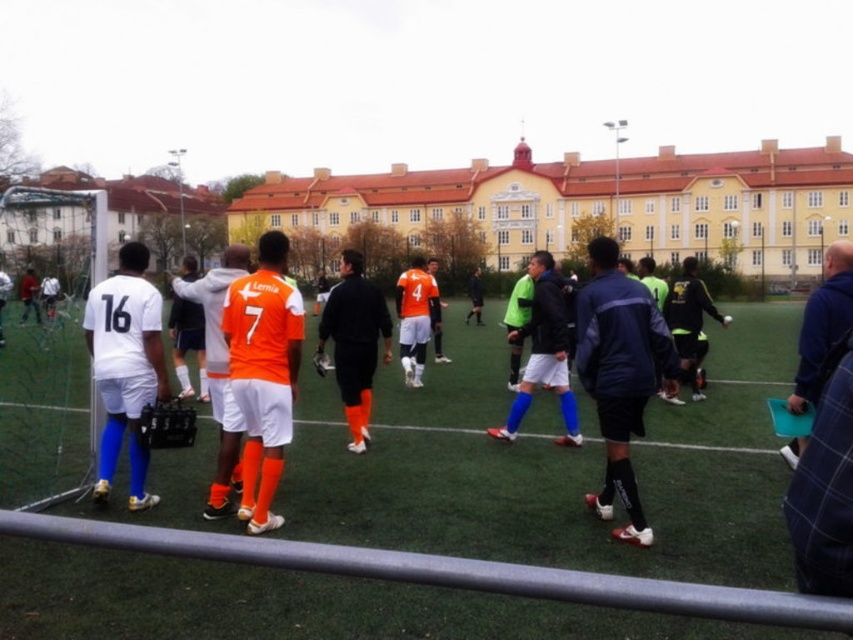
Where is `matte white jersey at left`? The image size is (853, 640). matte white jersey at left is located at coordinates (125, 365).

Does point (135, 262) come farther from viewer compared to point (837, 333)?

That is True.

Image resolution: width=853 pixels, height=640 pixels. What do you see at coordinates (125, 365) in the screenshot?
I see `matte white jersey at left` at bounding box center [125, 365].

Find the location of a particular element. Image resolution: width=853 pixels, height=640 pixels. matte white jersey at left is located at coordinates (125, 365).

Does point (521, 595) lie in front of point (97, 483)?

That is True.

Who is higher up, metallic gray rail at lower center or matte white jersey at left?

matte white jersey at left is higher up.

Which is behind, point (90, 518) or point (138, 330)?

The point (138, 330) is more distant.

I want to click on metallic gray rail at lower center, so click(450, 572).

Can you confirm if white matte soccer jersey at left is positioned below neon green jersey at center?

Indeed, white matte soccer jersey at left is positioned under neon green jersey at center.

Image resolution: width=853 pixels, height=640 pixels. What do you see at coordinates (262, 385) in the screenshot?
I see `white matte soccer jersey at left` at bounding box center [262, 385].

Who is more forward, [631,304] or [566,394]?

Point [631,304] is in front.

Where is `white matte soccer jersey at left`? The height and width of the screenshot is (640, 853). white matte soccer jersey at left is located at coordinates (262, 385).